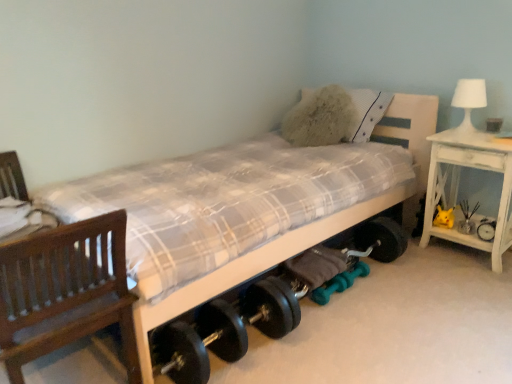
Question: From the image's perspective, is teal rubber dumbbell at lower center, placed as the 2th dumbbell when sorted from right to left, below white wood bed at center?

Choices:
 (A) no
 (B) yes

Answer: (B)

Question: Is teal rubber dumbbell at lower center, marked as the first dumbbell in a left-to-right arrangement, looking in the opposite direction of white wood bed at center?

Choices:
 (A) yes
 (B) no

Answer: (A)

Question: Considering the relative sizes of teal rubber dumbbell at lower center, placed as the 2th dumbbell when sorted from right to left, and white wood bed at center in the image provided, is teal rubber dumbbell at lower center, placed as the 2th dumbbell when sorted from right to left, bigger than white wood bed at center?

Choices:
 (A) no
 (B) yes

Answer: (A)

Question: Does teal rubber dumbbell at lower center, placed as the 2th dumbbell when sorted from right to left, have a lesser width compared to white wood bed at center?

Choices:
 (A) no
 (B) yes

Answer: (B)

Question: Is teal rubber dumbbell at lower center, marked as the first dumbbell in a left-to-right arrangement, facing towards white wood bed at center?

Choices:
 (A) yes
 (B) no

Answer: (B)

Question: Is white wood bed at center a part of teal rubber dumbbell at lower center, placed as the 2th dumbbell when sorted from right to left?

Choices:
 (A) no
 (B) yes

Answer: (A)

Question: Can you confirm if white wood bed at center is bigger than white distressed wood nightstand at right?

Choices:
 (A) no
 (B) yes

Answer: (B)

Question: Would you say white wood bed at center is a long distance from white distressed wood nightstand at right?

Choices:
 (A) no
 (B) yes

Answer: (A)

Question: Does white wood bed at center have a greater height compared to white distressed wood nightstand at right?

Choices:
 (A) yes
 (B) no

Answer: (A)

Question: Does white wood bed at center have a lesser width compared to white distressed wood nightstand at right?

Choices:
 (A) no
 (B) yes

Answer: (A)

Question: Is white wood bed at center smaller than white distressed wood nightstand at right?

Choices:
 (A) yes
 (B) no

Answer: (B)

Question: Can you see white wood bed at center touching white distressed wood nightstand at right?

Choices:
 (A) yes
 (B) no

Answer: (B)

Question: Considering the relative sizes of yellow plush toy at right and teal rubber dumbbell at lower center, which appears as the 2th dumbbell when viewed from the left, in the image provided, is yellow plush toy at right thinner than teal rubber dumbbell at lower center, which appears as the 2th dumbbell when viewed from the left,?

Choices:
 (A) no
 (B) yes

Answer: (A)